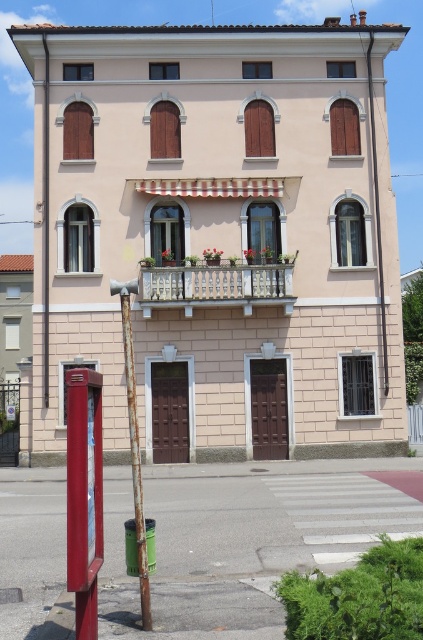
Question: Which is nearer to the metallic red phone box at lower left?

Choices:
 (A) wooden at upper right
 (B) white wood shutter at left

Answer: (B)

Question: Is black metal shutter at center above white wood shutter at left?

Choices:
 (A) no
 (B) yes

Answer: (A)

Question: Which point is closer to the camera taking this photo?

Choices:
 (A) (134, 477)
 (B) (178, 140)

Answer: (A)

Question: Is metallic red phone box at lower left above brown wooden shutter at center?

Choices:
 (A) yes
 (B) no

Answer: (B)

Question: Is rusty metal pole at center wider than brown wooden shutter at upper center?

Choices:
 (A) yes
 (B) no

Answer: (A)

Question: Which point is farther to the camera?

Choices:
 (A) white painted wood balcony at center
 (B) brown wooden shutter at center
 (C) white wood shutter at left

Answer: (B)